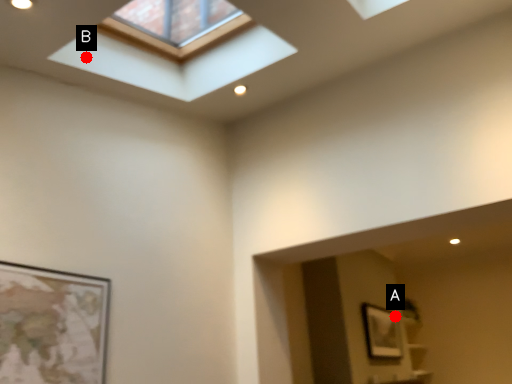
Question: Two points are circled on the image, labeled by A and B beside each circle. Among these points, which one is nearest to the camera?

Choices:
 (A) A is closer
 (B) B is closer

Answer: (B)